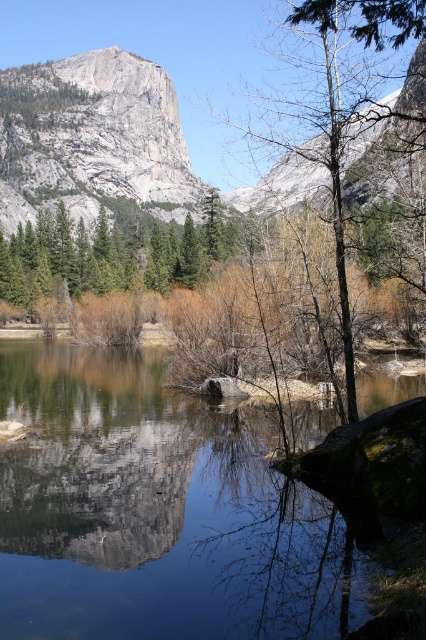
Question: Based on their relative distances, which object is nearer to the green matte tree at center?

Choices:
 (A) gray rock mountain at upper left
 (B) transparent water at center

Answer: (A)

Question: Which point is closer to the camera?

Choices:
 (A) transparent water at center
 (B) gray rock mountain at upper left

Answer: (A)

Question: In this image, where is green matte tree at center located relative to bare branches at center?

Choices:
 (A) below
 (B) above

Answer: (A)

Question: Is transparent water at center wider than gray rock mountain at upper left?

Choices:
 (A) yes
 (B) no

Answer: (B)

Question: Observing the image, what is the correct spatial positioning of transparent water at center in reference to bare branches at center?

Choices:
 (A) below
 (B) above

Answer: (A)

Question: Which object is the closest to the green matte tree at center?

Choices:
 (A) bare branches at center
 (B) gray rock mountain at upper left

Answer: (B)